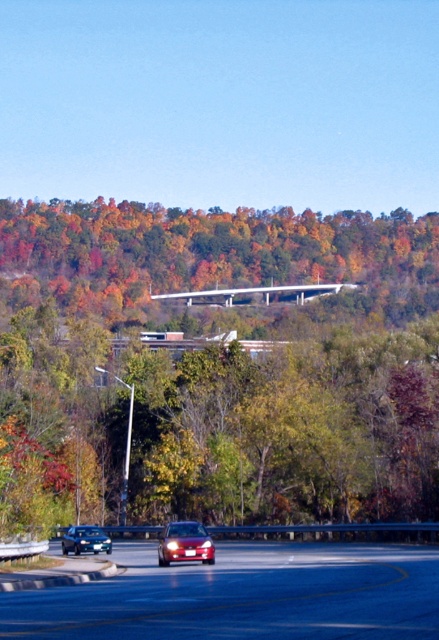
Question: Considering the real-world distances, which object is farthest from the green leafy tree at center?

Choices:
 (A) shiny black car at center
 (B) shiny red car at center

Answer: (B)

Question: Among these objects, which one is nearest to the camera?

Choices:
 (A) shiny red car at center
 (B) shiny black sedan at lower left

Answer: (A)

Question: Is shiny red car at center to the right of shiny black sedan at lower left from the viewer's perspective?

Choices:
 (A) yes
 (B) no

Answer: (A)

Question: Which point is farther from the camera taking this photo?

Choices:
 (A) (7, 225)
 (B) (72, 545)
 (C) (201, 531)

Answer: (A)

Question: Does green leafy tree at center lie in front of shiny red car at center?

Choices:
 (A) no
 (B) yes

Answer: (B)

Question: Is shiny black car at center thinner than shiny red car at center?

Choices:
 (A) yes
 (B) no

Answer: (B)